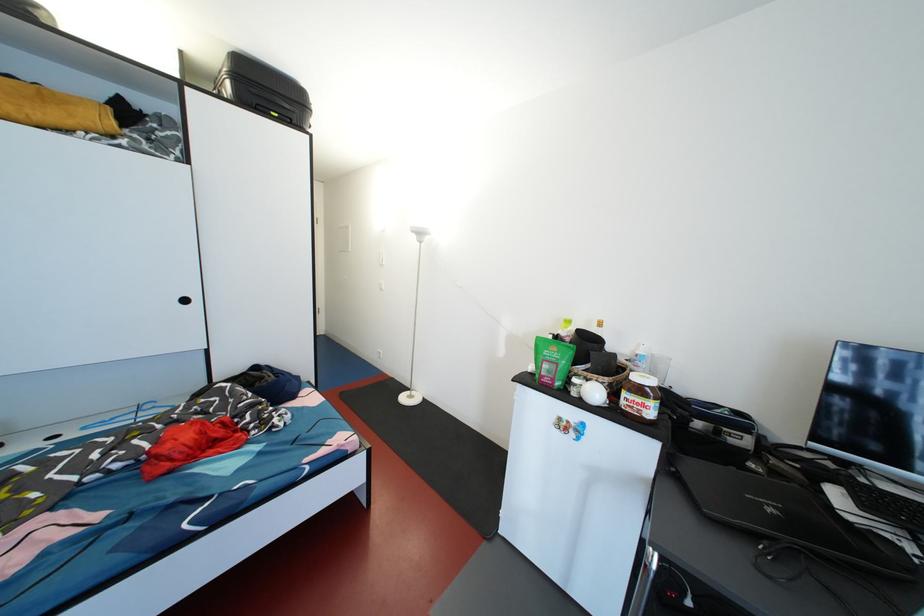
The width and height of the screenshot is (924, 616). Identify the location of white floor lamp. (415, 321).